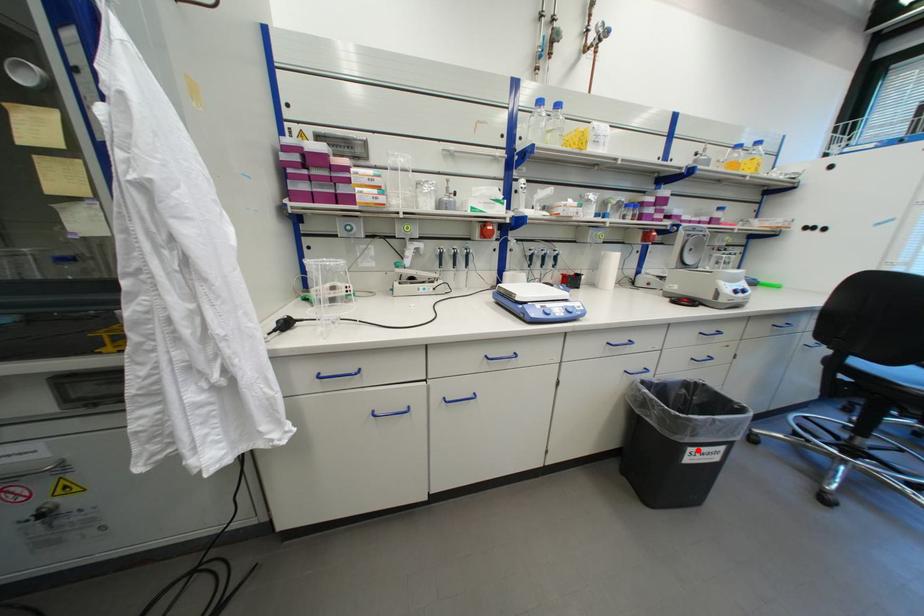
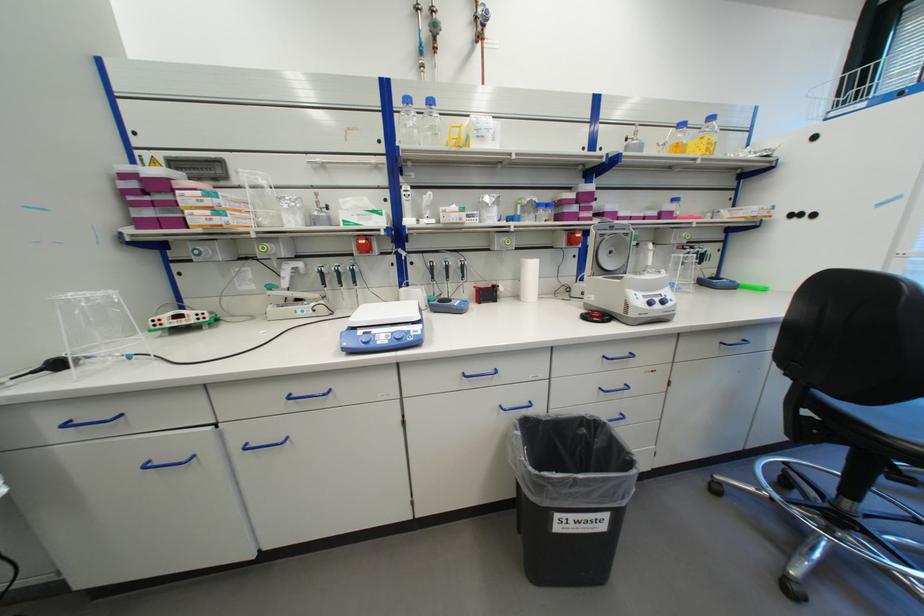
The point at the highlighted location is marked in the first image. Where is the corresponding point in the second image?

(565, 517)